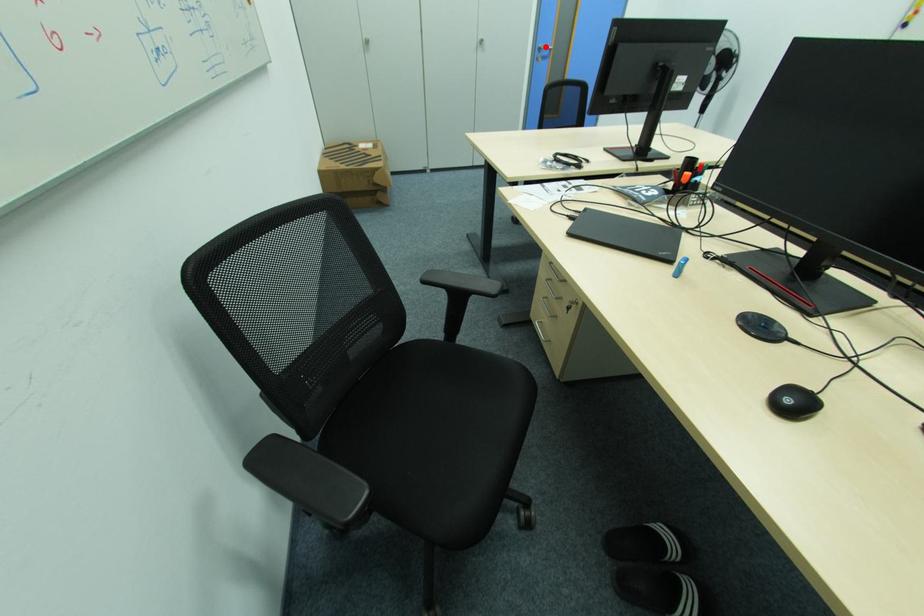
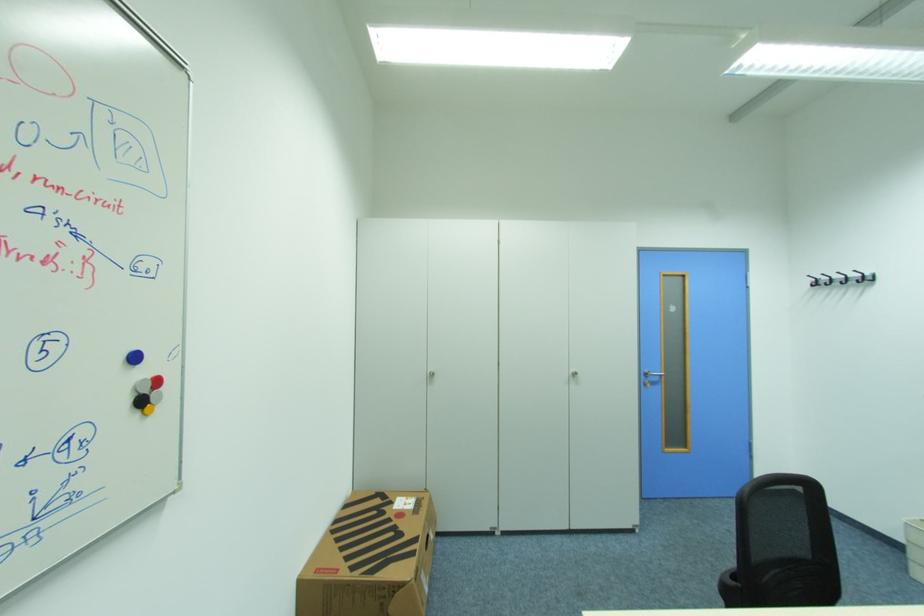
Question: I am providing you with two images of the same scene from different viewpoints. Given a red point in image1, look at the same physical point in image2. Is it:

Choices:
 (A) Closer to the viewpoint
 (B) Farther from the viewpoint

Answer: (B)